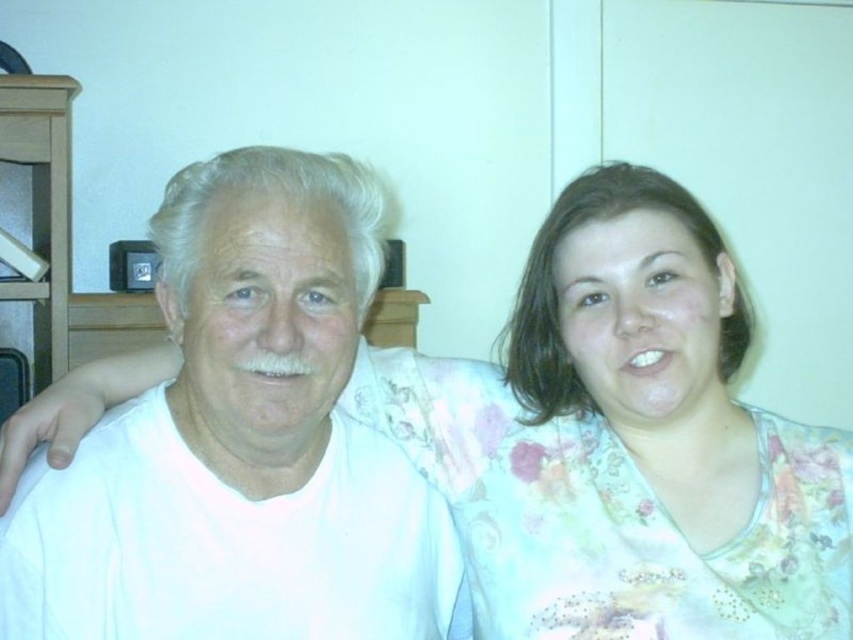
Based on the photo, between white matte shirt at center and floral fabric blouse at right, which one is positioned higher?

floral fabric blouse at right is above.

Is white matte shirt at center above floral fabric blouse at right?

No.

The height and width of the screenshot is (640, 853). Identify the location of white matte shirt at center. [x=244, y=442].